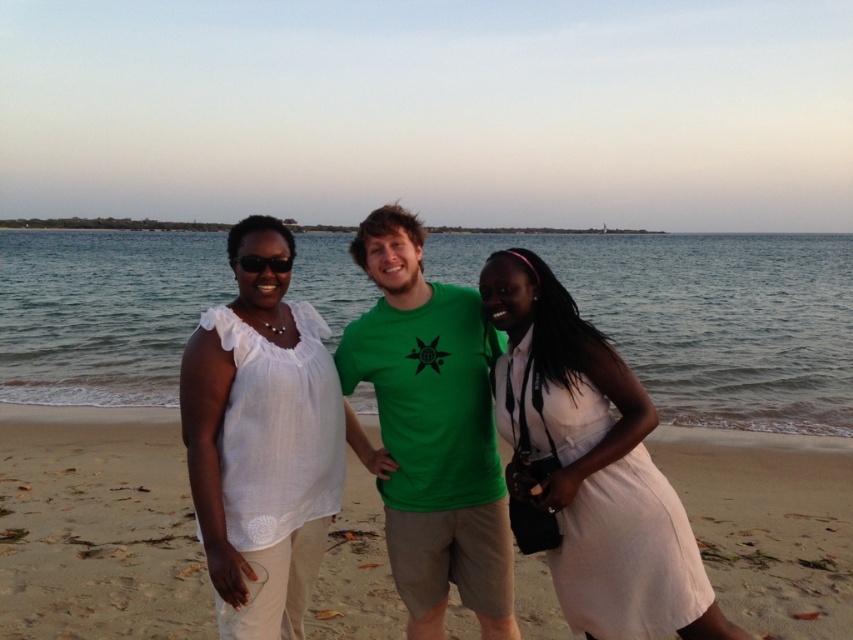
You are a photographer planning to take a group photo of the people on the beach. You want to ensure that the clear blue water at center and the white satin dress at center are both visible in the frame. Based on their heights, which object should be positioned closer to the front to avoid being obscured?

The white satin dress at center should be positioned closer to the front since it is shorter in height than the clear blue water at center, preventing it from being obscured by the taller object.

You are a photographer trying to capture a clear shot of the white satin dress at center and the sandy beach at center. Which object is closer to the camera based on their positions?

The sandy beach at center is closer to the camera than the white satin dress at center because the white satin dress at center is positioned behind the sandy beach at center.